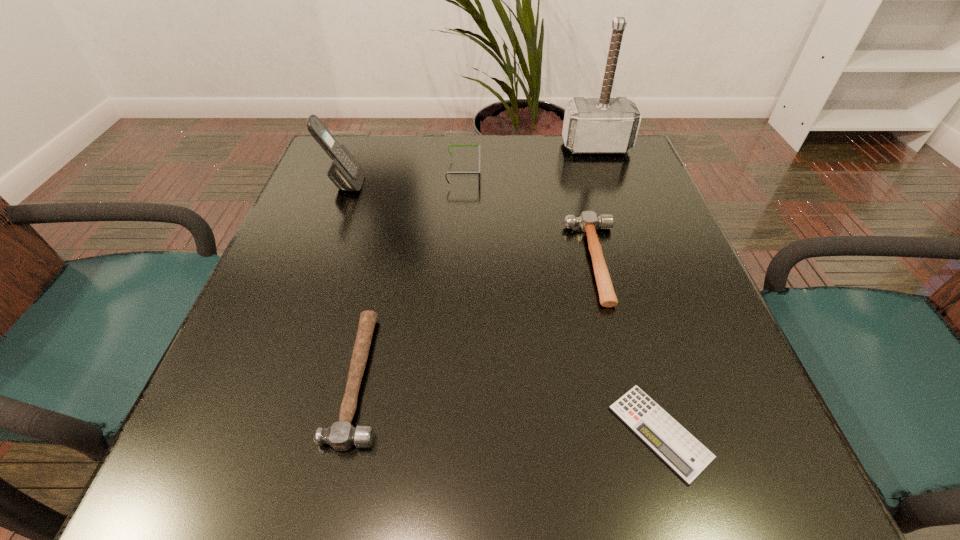
In the image, there is a desktop. Where is `vacant region at the far left corner`? vacant region at the far left corner is located at coordinates (376, 161).

Locate an element on the screen. This screenshot has width=960, height=540. vacant space at the near left corner of the desktop is located at coordinates (211, 495).

Locate an element on the screen. This screenshot has width=960, height=540. vacant region at the far right corner of the desktop is located at coordinates (608, 154).

In the image, there is a desktop. Where is `vacant space at the near right corner`? vacant space at the near right corner is located at coordinates (794, 496).

The image size is (960, 540). I want to click on free space between the calculator and the fifth object from right to left, so 510,405.

The height and width of the screenshot is (540, 960). What are the coordinates of `vacant area between the calculator and the fourth farthest object` in the screenshot? It's located at pyautogui.click(x=628, y=347).

Identify the location of empty location between the second nearest hammer and the fourth object from right to left. (530, 217).

Where is `vacant area between the farthest object and the shortest object`? The width and height of the screenshot is (960, 540). vacant area between the farthest object and the shortest object is located at coordinates (628, 289).

At what (x,y) coordinates should I click in order to perform the action: click on free spot between the spectacles and the second farthest hammer. Please return your answer as a coordinate pair (x, y). Looking at the image, I should click on (530, 217).

At what (x,y) coordinates should I click in order to perform the action: click on empty space that is in between the shortest object and the fourth farthest object. Please return your answer as a coordinate pair (x, y). Looking at the image, I should click on (628, 347).